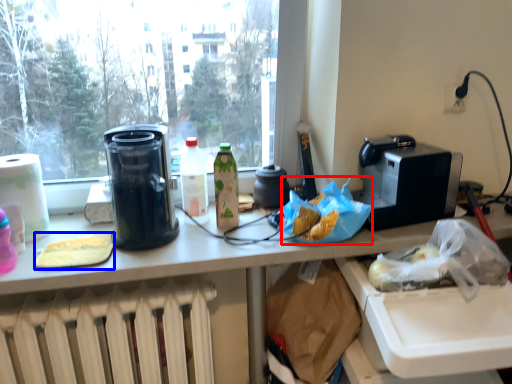
Question: Which object appears closest to the camera in this image, food (highlighted by a red box) or food (highlighted by a blue box)?

Choices:
 (A) food
 (B) food

Answer: (B)